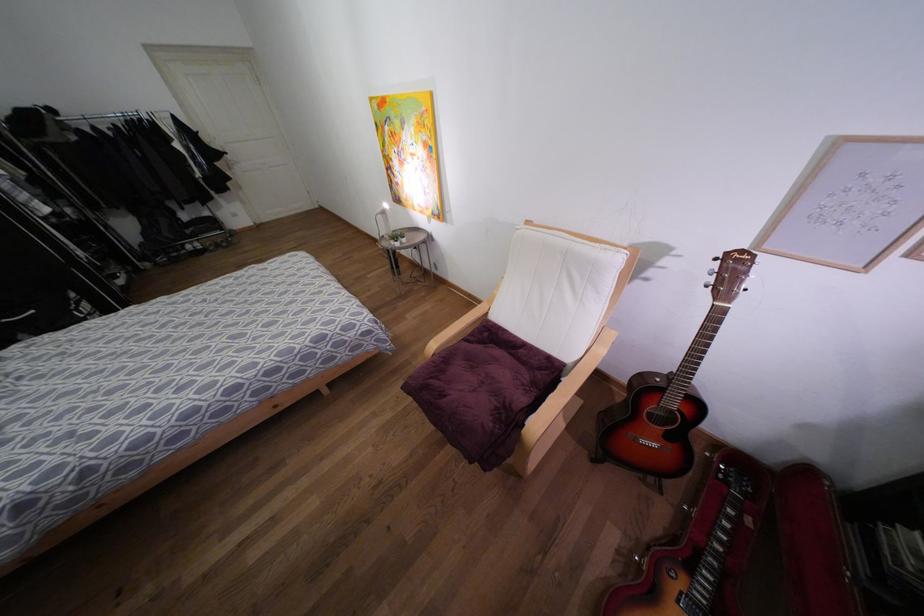
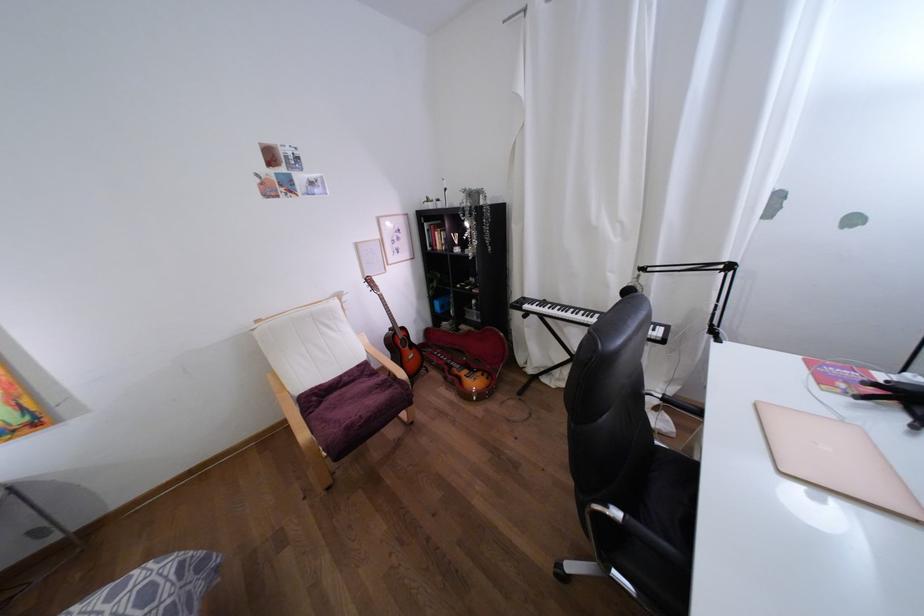
Locate, in the second image, the point that corresponds to point 690,392 in the first image.

(398, 325)